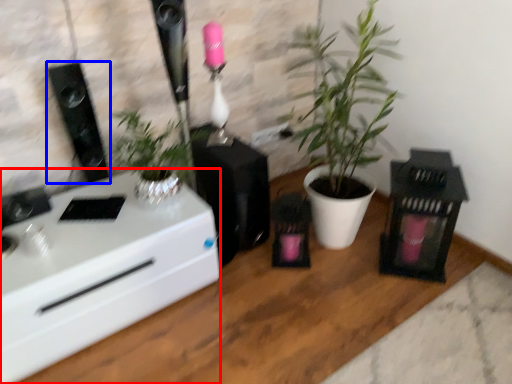
Question: Which object is further to the camera taking this photo, desk (highlighted by a red box) or loudspeaker (highlighted by a blue box)?

Choices:
 (A) desk
 (B) loudspeaker

Answer: (B)